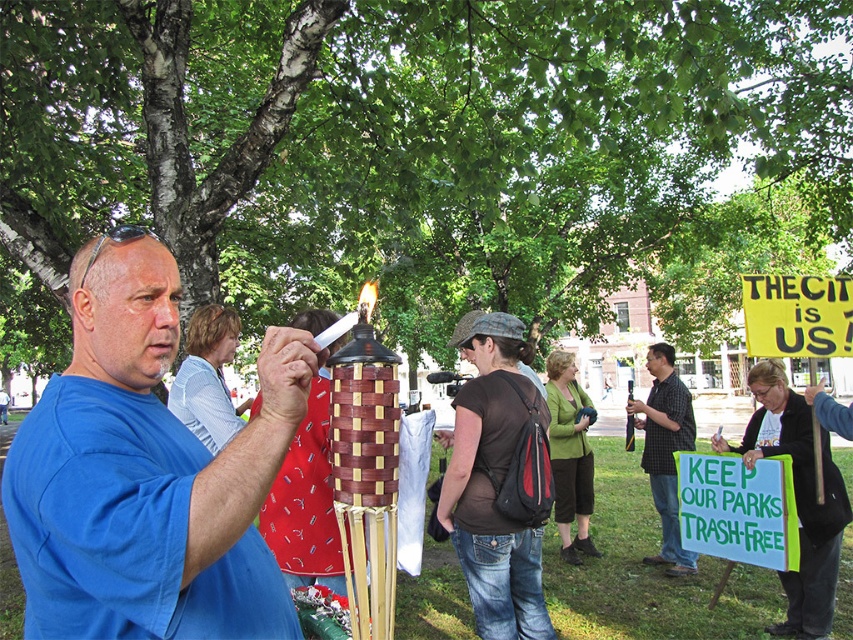
What is the 2D coordinate of the blue woven basket at center?

The blue woven basket at center is located at the 2D coordinate of point (146,474).

You are a delivery drone that needs to drop off a package to the brown fabric backpack at center. The drone has a GPS coordinate system where the bottom left corner of the image is the origin point. What are the coordinates you should aim for to drop the package accurately?

The coordinates for the brown fabric backpack at center are at point (492, 483), so the drone should aim for those coordinates to drop the package accurately.